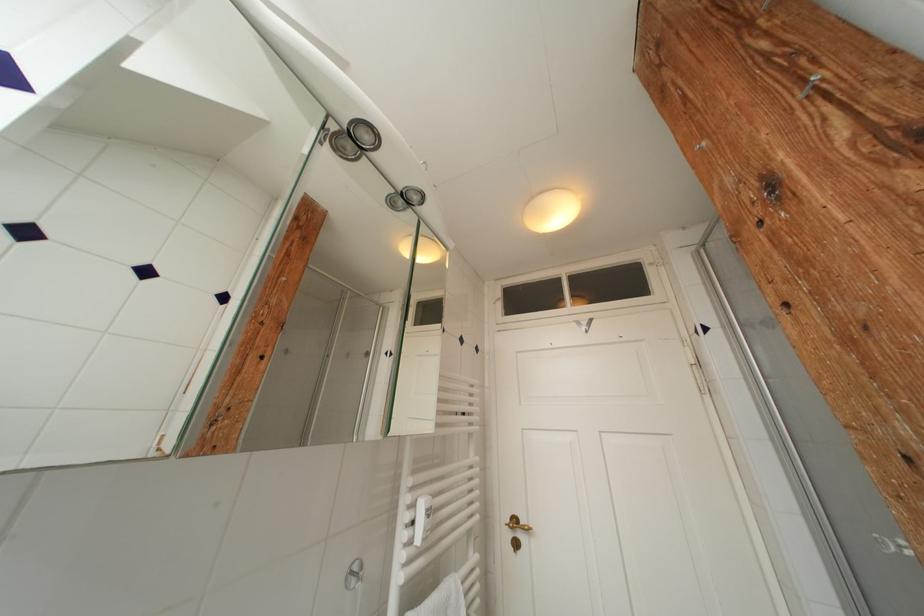
This screenshot has width=924, height=616. I want to click on brass door handle, so click(518, 525).